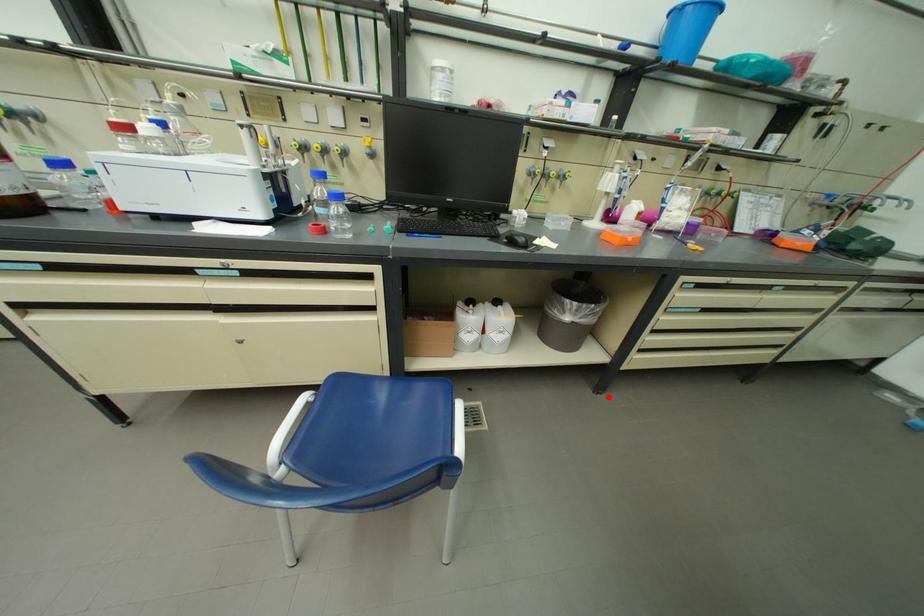
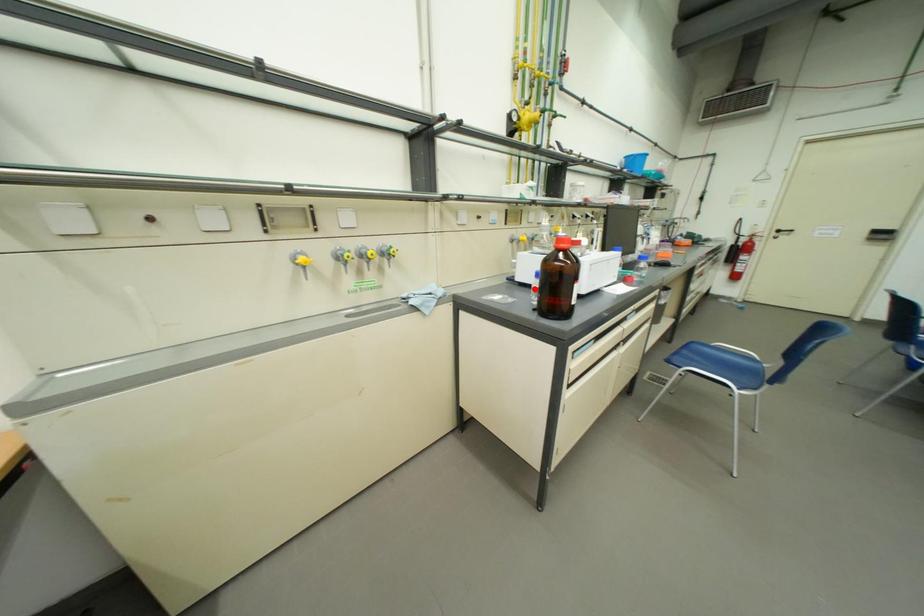
I am providing you with two images of the same scene from different viewpoints. A red point is marked on the first image and another point is marked on the second image. Is the marked point in image1 the same physical position as the marked point in image2?

No